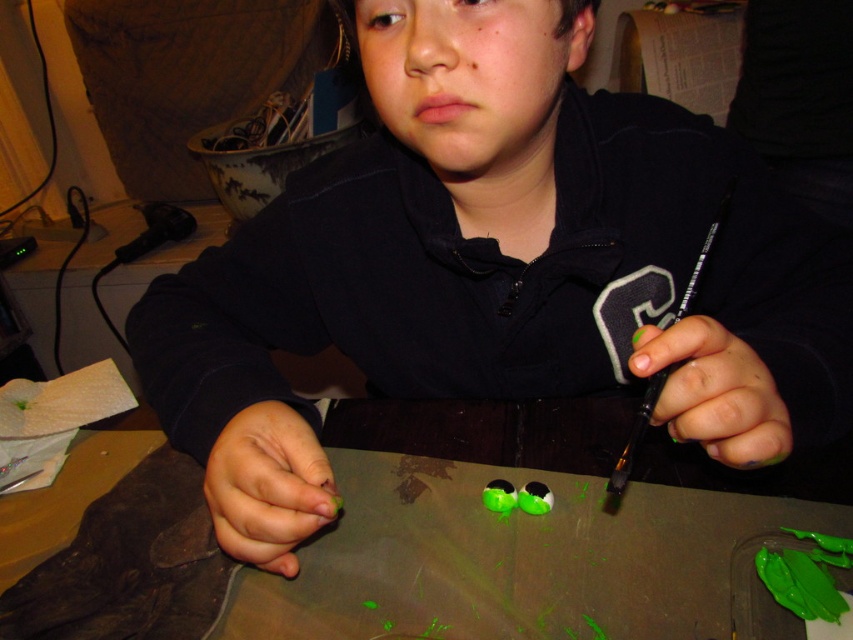
Is green matte table at center above green matte nail polish at right?

No.

Can you confirm if green matte table at center is positioned to the right of green matte nail polish at right?

Incorrect, green matte table at center is not on the right side of green matte nail polish at right.

This screenshot has height=640, width=853. In order to click on green matte table at center in this screenshot , I will do `click(128, 564)`.

Which of these two, green matte table at center or green matte fingernail at lower center, stands taller?

green matte table at center is taller.

Between green matte table at center and green matte fingernail at lower center, which one is positioned lower?

green matte table at center is below.

Does point (50, 557) lie in front of point (248, 557)?

No, it is behind (248, 557).

Identify the location of green matte table at center. (128, 564).

Who is more forward, (302, 433) or (722, 328)?

Positioned in front is point (722, 328).

Is green matte fingernail at lower center below green matte nail polish at right?

Indeed, green matte fingernail at lower center is positioned under green matte nail polish at right.

Between point (323, 490) and point (756, 422), which one is positioned in front?

Point (756, 422) is in front.

Where is `green matte fingernail at lower center`? The width and height of the screenshot is (853, 640). green matte fingernail at lower center is located at coordinates (268, 486).